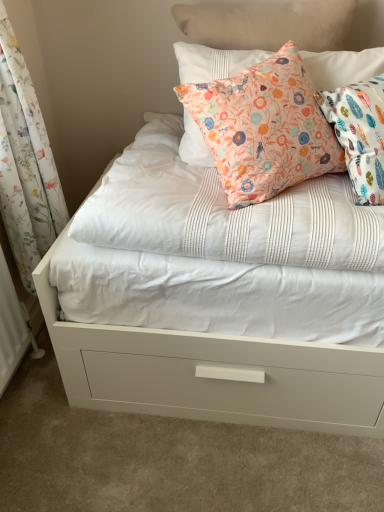
Question: Is floral fabric pillow at upper center touching floral fabric curtain at left?

Choices:
 (A) no
 (B) yes

Answer: (A)

Question: Can you confirm if floral fabric pillow at upper center is shorter than floral fabric curtain at left?

Choices:
 (A) yes
 (B) no

Answer: (A)

Question: Can you confirm if floral fabric pillow at upper center is smaller than floral fabric curtain at left?

Choices:
 (A) no
 (B) yes

Answer: (B)

Question: Is floral fabric pillow at upper center at the right side of floral fabric curtain at left?

Choices:
 (A) yes
 (B) no

Answer: (A)

Question: Is floral fabric curtain at left located within floral fabric pillow at upper center?

Choices:
 (A) yes
 (B) no

Answer: (B)

Question: Considering the relative sizes of floral fabric pillow at upper center and floral fabric curtain at left in the image provided, is floral fabric pillow at upper center taller than floral fabric curtain at left?

Choices:
 (A) yes
 (B) no

Answer: (B)

Question: Does floral fabric curtain at left appear on the left side of floral fabric pillow at upper center?

Choices:
 (A) yes
 (B) no

Answer: (A)

Question: Does floral fabric curtain at left have a greater height compared to floral fabric pillow at upper center?

Choices:
 (A) yes
 (B) no

Answer: (A)

Question: Can you confirm if floral fabric curtain at left is wider than floral fabric pillow at upper center?

Choices:
 (A) yes
 (B) no

Answer: (B)

Question: From a real-world perspective, is floral fabric curtain at left physically below floral fabric pillow at upper center?

Choices:
 (A) yes
 (B) no

Answer: (A)

Question: From the image's perspective, is floral fabric curtain at left located beneath floral fabric pillow at upper center?

Choices:
 (A) yes
 (B) no

Answer: (A)

Question: Is floral fabric curtain at left bigger than floral fabric pillow at upper center?

Choices:
 (A) no
 (B) yes

Answer: (B)

Question: From the image's perspective, is floral fabric curtain at left located above or below floral fabric pillow at upper center?

Choices:
 (A) above
 (B) below

Answer: (B)